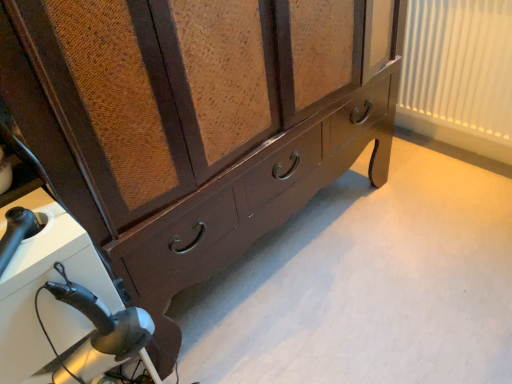
Question: Does white pleated curtain at upper right have a greater width compared to black plastic hairdryer at lower left?

Choices:
 (A) yes
 (B) no

Answer: (B)

Question: Is white pleated curtain at upper right further to camera compared to black plastic hairdryer at lower left?

Choices:
 (A) yes
 (B) no

Answer: (A)

Question: From a real-world perspective, is white pleated curtain at upper right physically above black plastic hairdryer at lower left?

Choices:
 (A) yes
 (B) no

Answer: (A)

Question: Can you confirm if white pleated curtain at upper right is positioned to the right of black plastic hairdryer at lower left?

Choices:
 (A) no
 (B) yes

Answer: (B)

Question: Are white pleated curtain at upper right and black plastic hairdryer at lower left located far from each other?

Choices:
 (A) no
 (B) yes

Answer: (B)

Question: From the image's perspective, would you say white pleated curtain at upper right is positioned over black plastic hairdryer at lower left?

Choices:
 (A) no
 (B) yes

Answer: (B)

Question: Does black plastic hairdryer at lower left have a greater height compared to white pleated curtain at upper right?

Choices:
 (A) yes
 (B) no

Answer: (A)

Question: Considering the relative sizes of black plastic hairdryer at lower left and white pleated curtain at upper right in the image provided, is black plastic hairdryer at lower left bigger than white pleated curtain at upper right?

Choices:
 (A) yes
 (B) no

Answer: (A)

Question: Is white pleated curtain at upper right surrounded by black plastic hairdryer at lower left?

Choices:
 (A) yes
 (B) no

Answer: (B)

Question: Is black plastic hairdryer at lower left located outside white pleated curtain at upper right?

Choices:
 (A) no
 (B) yes

Answer: (B)

Question: Can you confirm if black plastic hairdryer at lower left is shorter than white pleated curtain at upper right?

Choices:
 (A) no
 (B) yes

Answer: (A)

Question: Is black plastic hairdryer at lower left further to camera compared to white pleated curtain at upper right?

Choices:
 (A) yes
 (B) no

Answer: (B)

Question: Is point (147, 329) positioned closer to the camera than point (432, 102)?

Choices:
 (A) farther
 (B) closer

Answer: (B)